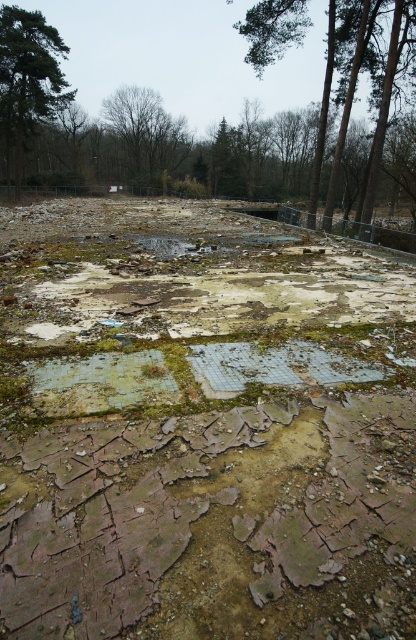
You are standing at the lower part of the image and looking towards the upper part. Which tree, the green leafy tree at upper left or the brown leafless tree at upper center, is closer to your left side?

The green leafy tree at upper left is positioned on the left side of the brown leafless tree at upper center, so when looking towards the upper part, the green leafy tree at upper left is closer to your left side.

You are standing at the point labeled point (17, 45) and want to walk towards the point labeled point (398, 26). Which direction should you face to move directly towards it?

You should face north because point (398, 26) is in front of point (17, 45), indicating it is north of your current position.

You are standing in the desolate area and want to look at the trees. Which tree, the brown wood tree at upper center or the green leafy tree at upper left, is positioned higher up in the image?

The brown wood tree at upper center is located above the green leafy tree at upper left, so it is positioned higher up in the image.